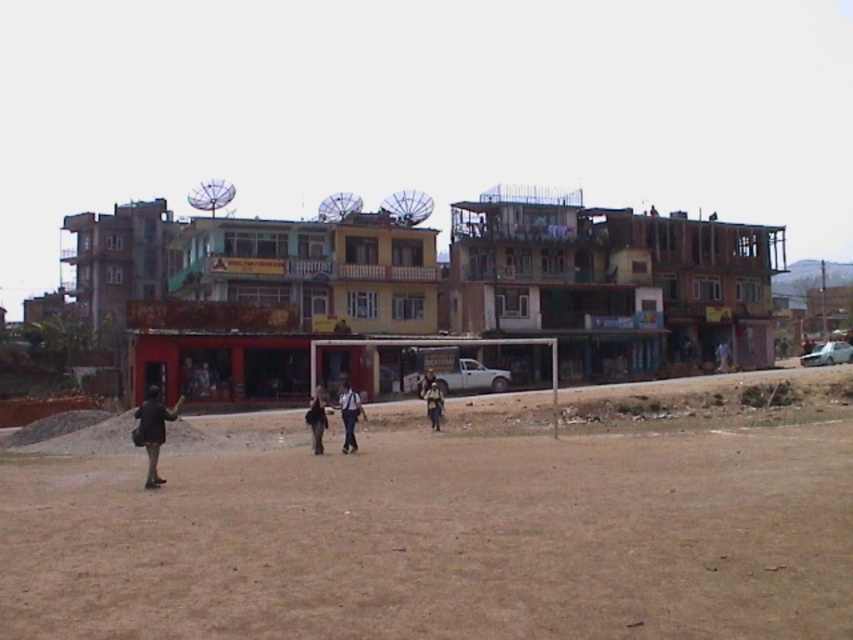
Question: Which object is closer to the camera taking this photo?

Choices:
 (A) dark brown leather jacket at center
 (B) light brown fabric backpack at center

Answer: (A)

Question: Is dark blue jeans at center wider than light brown fabric backpack at center?

Choices:
 (A) no
 (B) yes

Answer: (B)

Question: Does brown sandy dirt field at lower center appear on the left side of light brown fabric backpack at center?

Choices:
 (A) no
 (B) yes

Answer: (A)

Question: Which point appears farthest from the camera in this image?

Choices:
 (A) (173, 413)
 (B) (318, 400)

Answer: (B)

Question: Estimate the real-world distances between objects in this image. Which object is closer to the brown sandy dirt field at lower center?

Choices:
 (A) dark blue jeans at center
 (B) dark brown leather jacket at center
 (C) dark brown jacket at lower left
 (D) light brown fabric backpack at center

Answer: (A)

Question: Does dark brown jacket at lower left lie in front of dark brown leather jacket at center?

Choices:
 (A) yes
 (B) no

Answer: (A)